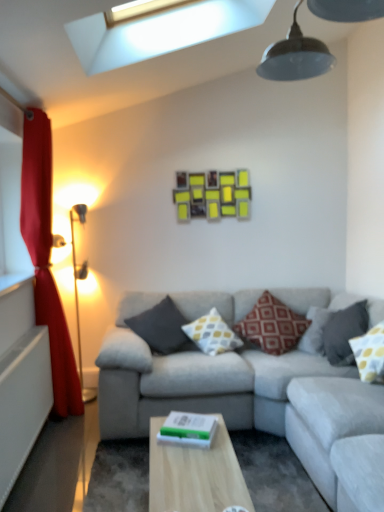
Question: In the image, is yellow dotted fabric pillow at right, the first pillow in the right-to-left sequence, positioned in front of or behind yellow dotted pillow at center, the 2th pillow from the left?

Choices:
 (A) front
 (B) behind

Answer: (A)

Question: Is yellow dotted fabric pillow at right, the first pillow in the right-to-left sequence, bigger or smaller than yellow dotted pillow at center, the 2th pillow from the left?

Choices:
 (A) small
 (B) big

Answer: (A)

Question: Which is nearer to the gold metallic floor lamp at left?

Choices:
 (A) light wood table at center
 (B) yellow dotted fabric pillow at right, marked as the fifth pillow in a left-to-right arrangement
 (C) red velvet curtain at left
 (D) yellow dotted pillow at center, positioned as the fourth pillow in right-to-left order
 (E) dark gray fabric pillow at center, which is counted as the 5th pillow, starting from the right

Answer: (C)

Question: Considering the real-world distances, which object is farthest from the yellow dotted fabric pillow at right, the first pillow in the right-to-left sequence?

Choices:
 (A) yellow matte picture frame at upper center
 (B) gray fabric couch at center
 (C) gold metallic floor lamp at left
 (D) dark gray fabric pillow at right, acting as the 2th pillow starting from the right
 (E) dark gray fabric pillow at center, marked as the 1th pillow in a left-to-right arrangement

Answer: (C)